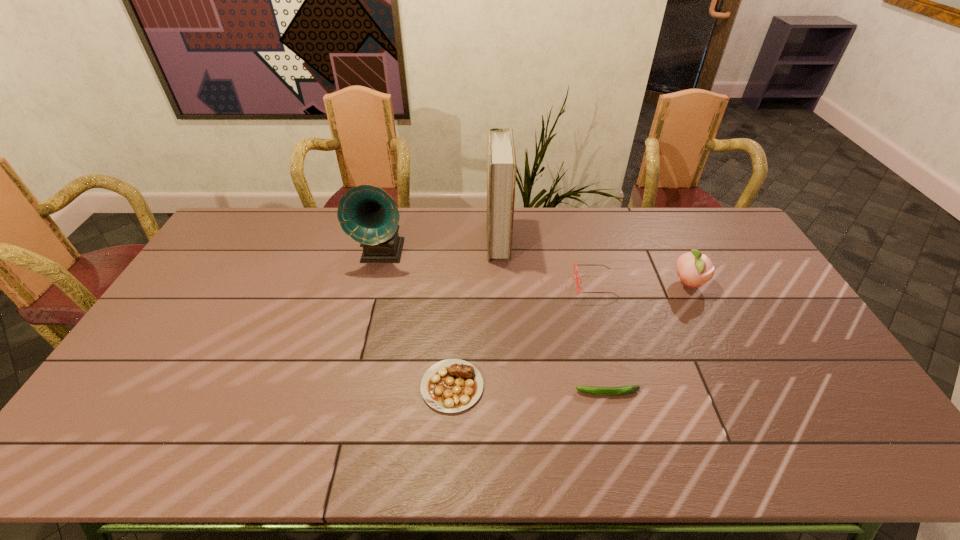
Locate an element on the screen. free location located on the front-facing side of the shortest object is located at coordinates point(529,393).

Image resolution: width=960 pixels, height=540 pixels. Identify the location of vacant area situated on the front-facing side of the shortest object. (444, 393).

Find the location of a particular element. Image resolution: width=960 pixels, height=540 pixels. phonebook that is at the far edge is located at coordinates (501, 161).

Find the location of `phonograph_record located in the far edge section of the desktop`. phonograph_record located in the far edge section of the desktop is located at coordinates (369, 215).

At what (x,y) coordinates should I click in order to perform the action: click on vacant area at the far edge of the desktop. Please return your answer as a coordinate pair (x, y). Image resolution: width=960 pixels, height=540 pixels. Looking at the image, I should click on (351, 243).

The image size is (960, 540). Identify the location of vacant region at the near edge of the desktop. (778, 450).

This screenshot has height=540, width=960. In order to click on vacant area at the left edge in this screenshot , I will do `click(115, 406)`.

Locate an element on the screen. Image resolution: width=960 pixels, height=540 pixels. vacant space at the right edge of the desktop is located at coordinates coord(706,253).

The image size is (960, 540). Find the location of `vacant region at the far right corner of the desktop`. vacant region at the far right corner of the desktop is located at coordinates 702,233.

You are a GUI agent. You are given a task and a screenshot of the screen. Output one action in this format:
    pyautogui.click(x=<x>, y=<y>)
    Task: Click on the vacant space at the near right corner of the desktop
    The height and width of the screenshot is (540, 960).
    Given the screenshot: What is the action you would take?
    pyautogui.click(x=824, y=427)